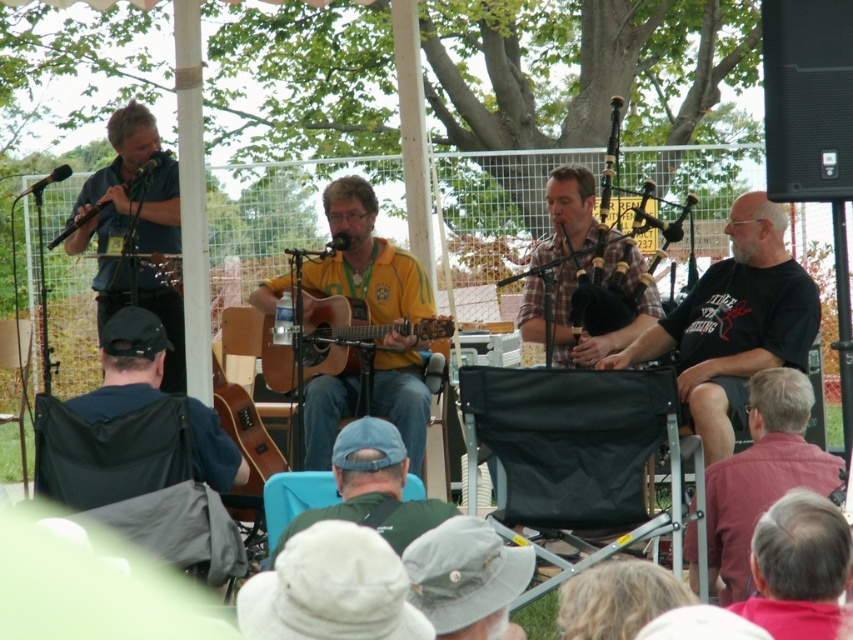
You are a photographer at the event and need to capture a closeup of the black cotton shirt at right and the matte black microphone at left. Based on their positions, which one should you focus on first to ensure it doesn t get out of frame?

The black cotton shirt at right is located below the matte black microphone at left, so you should focus on the matte black microphone at left first to ensure it stays in frame before adjusting for the lower positioned black cotton shirt at right.

Based on the photo, based on the scene description, where is the plaid fabric bagpipes at center located in the image?

The plaid fabric bagpipes at center is located at point (589, 333) in the image.

You are a photographer at the event and want to capture a closeup of the pink shirt at lower right. Based on its coordinates, where should you aim your camera?

The pink shirt at lower right is located at coordinates point (762, 474), so aim your camera there.